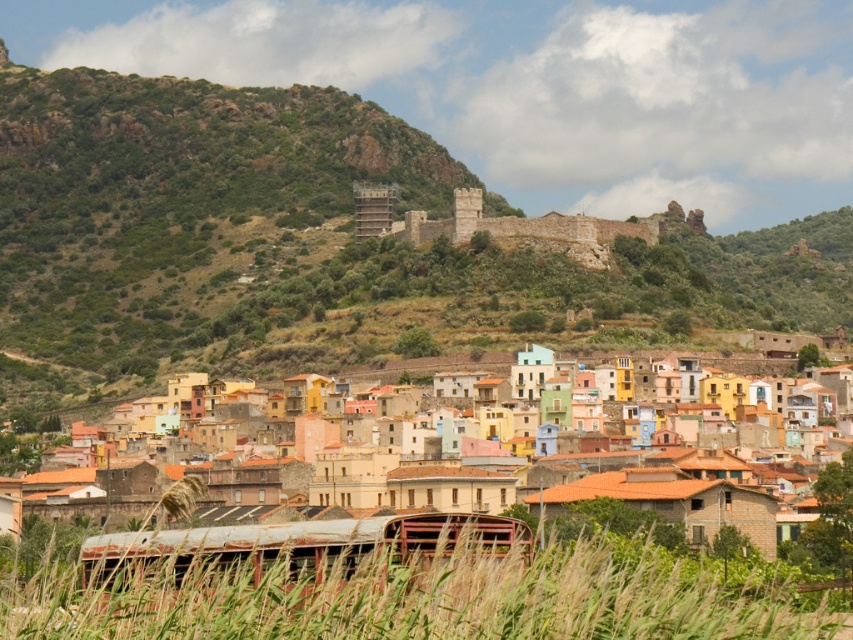
Does multicolored stone village at center appear under rusty metal train at lower center?

Incorrect, multicolored stone village at center is not positioned below rusty metal train at lower center.

Where is `multicolored stone village at center`? This screenshot has width=853, height=640. multicolored stone village at center is located at coordinates [x=679, y=483].

Is multicolored stone village at center further to camera compared to stone castle at center?

No.

Does multicolored stone village at center appear over stone castle at center?

No.

Is point (448, 483) more distant than point (601, 244)?

No, (448, 483) is in front of (601, 244).

Locate an element on the screen. Image resolution: width=853 pixels, height=640 pixels. multicolored stone village at center is located at coordinates (679, 483).

Does rusty metal train at lower center lie behind stone castle at center?

No, rusty metal train at lower center is closer to the viewer.

Does rusty metal train at lower center have a greater height compared to stone castle at center?

No.

Measure the distance between point (273,541) and camera.

Point (273,541) and camera are 66.06 meters apart from each other.

You are a GUI agent. You are given a task and a screenshot of the screen. Output one action in this format:
    pyautogui.click(x=<x>, y=<y>)
    Task: Click on the rusty metal train at lower center
    The image size is (853, 640).
    Given the screenshot: What is the action you would take?
    pyautogui.click(x=302, y=552)